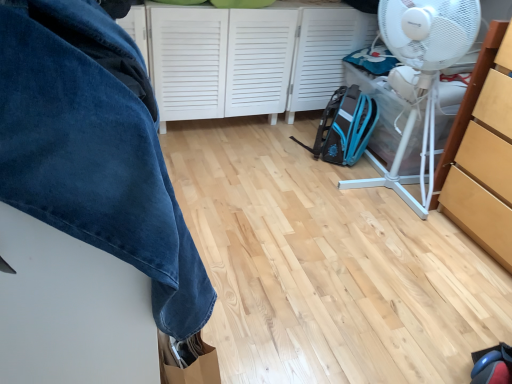
Question: Is white matte cabinet at center, placed as the second cabinetry when sorted from right to left, at the left side of velvety blue blanket at upper left?

Choices:
 (A) no
 (B) yes

Answer: (A)

Question: Can you confirm if white matte cabinet at center, which is the 1th cabinetry from left to right, is wider than velvety blue blanket at upper left?

Choices:
 (A) yes
 (B) no

Answer: (A)

Question: Can you confirm if white matte cabinet at center, which is the 1th cabinetry from left to right, is shorter than velvety blue blanket at upper left?

Choices:
 (A) yes
 (B) no

Answer: (A)

Question: Is the depth of white matte cabinet at center, which is the 1th cabinetry from left to right, less than that of velvety blue blanket at upper left?

Choices:
 (A) yes
 (B) no

Answer: (B)

Question: From a real-world perspective, is white matte cabinet at center, placed as the second cabinetry when sorted from right to left, positioned over velvety blue blanket at upper left based on gravity?

Choices:
 (A) no
 (B) yes

Answer: (A)

Question: In terms of width, does white plastic mechanical fan at right look wider or thinner when compared to velvety blue blanket at upper left?

Choices:
 (A) wide
 (B) thin

Answer: (A)

Question: Considering the positions of white plastic mechanical fan at right and velvety blue blanket at upper left in the image, is white plastic mechanical fan at right taller or shorter than velvety blue blanket at upper left?

Choices:
 (A) tall
 (B) short

Answer: (A)

Question: From the image's perspective, is white plastic mechanical fan at right located above or below velvety blue blanket at upper left?

Choices:
 (A) above
 (B) below

Answer: (A)

Question: Relative to velvety blue blanket at upper left, is white plastic mechanical fan at right in front or behind?

Choices:
 (A) front
 (B) behind

Answer: (B)

Question: From a real-world perspective, relative to light wood cabinet at right, which is the 1th cabinetry from right to left, is white plastic mechanical fan at right vertically above or below?

Choices:
 (A) below
 (B) above

Answer: (B)

Question: From the image's perspective, is white plastic mechanical fan at right above or below light wood cabinet at right, which is the 1th cabinetry from right to left?

Choices:
 (A) above
 (B) below

Answer: (A)

Question: Is white plastic mechanical fan at right wider or thinner than light wood cabinet at right, acting as the second cabinetry starting from the left?

Choices:
 (A) thin
 (B) wide

Answer: (B)

Question: In terms of height, does white plastic mechanical fan at right look taller or shorter compared to light wood cabinet at right, acting as the second cabinetry starting from the left?

Choices:
 (A) tall
 (B) short

Answer: (A)

Question: In terms of height, does teal fabric backpack at center-right look taller or shorter compared to white matte cabinet at center, which ranks as the second cabinetry in front-to-back order?

Choices:
 (A) short
 (B) tall

Answer: (A)

Question: From the image's perspective, is teal fabric backpack at center-right located above or below white matte cabinet at center, which is the 1th cabinetry from left to right?

Choices:
 (A) above
 (B) below

Answer: (B)